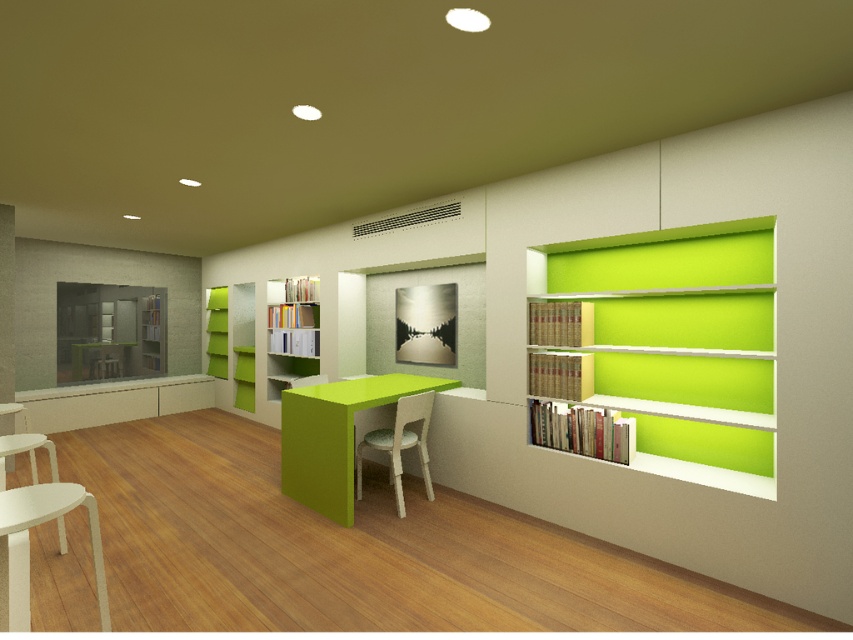
You are standing in the middle of the room and want to walk towards the two points marked in the image. Which point will you reach first, point (709, 440) or point (0, 579)?

Point (0, 579) will be reached first because it is closer to you than point (709, 440), which is further away from you.

You are standing in the modern minimalist library and need to locate two specific points marked in the image. The first point is at coordinate point (335, 497) and the second is at point (415, 397). Which of these points is closer to you from your current position?

Point (335, 497) is in front of point (415, 397), so it is closer to you.

You are a person sitting in the white textured chair at center. You want to place a book on the matte green table at center. Can you reach the table from your current position?

The matte green table at center is above the white textured chair at center, so yes, you can reach the table from the chair as it is positioned above you.